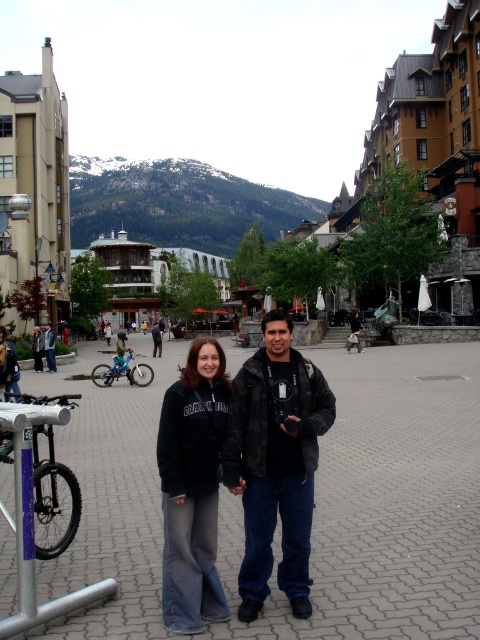
Is matte black bicycle at lower left further to camera compared to dark gray jacket at center?

No, matte black bicycle at lower left is in front of dark gray jacket at center.

Can you confirm if matte black bicycle at lower left is positioned below dark gray jacket at center?

Yes, matte black bicycle at lower left is below dark gray jacket at center.

Which is in front, point (45, 401) or point (160, 353)?

Point (45, 401)

You are a GUI agent. You are given a task and a screenshot of the screen. Output one action in this format:
    pyautogui.click(x=<x>, y=<y>)
    Task: Click on the matte black bicycle at lower left
    
    Given the screenshot: What is the action you would take?
    pyautogui.click(x=52, y=499)

Does black fleece jacket at center have a greater height compared to matte black bicycle at lower left?

Correct, black fleece jacket at center is much taller as matte black bicycle at lower left.

Who is positioned more to the right, black fleece jacket at center or matte black bicycle at lower left?

black fleece jacket at center is more to the right.

Is point (188, 419) closer to viewer compared to point (51, 460)?

Yes.

Image resolution: width=480 pixels, height=640 pixels. What are the coordinates of `black fleece jacket at center` in the screenshot? It's located at (192, 488).

Is point (72, 404) positioned after point (111, 365)?

No, (72, 404) is in front of (111, 365).

Is matte black bicycle at lower left positioned before blue metallic bicycle at lower left?

Yes.

I want to click on matte black bicycle at lower left, so click(52, 499).